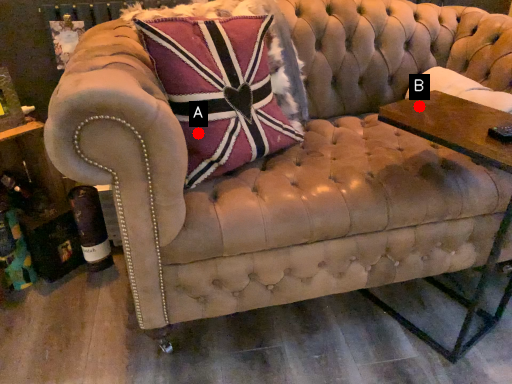
Question: Two points are circled on the image, labeled by A and B beside each circle. Which point is further to the camera?

Choices:
 (A) A is further
 (B) B is further

Answer: (B)